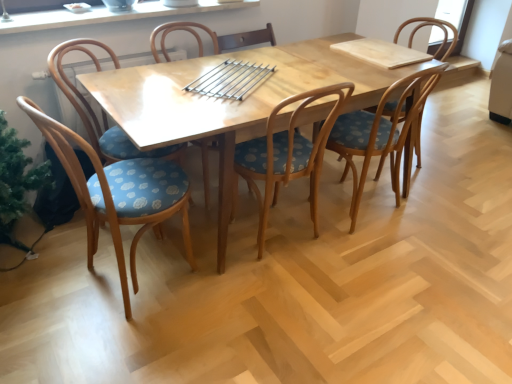
Question: From a real-world perspective, is blue polka dot wood chair at left, which is the 2th chair from left to right, positioned above or below natural wood table at center?

Choices:
 (A) below
 (B) above

Answer: (B)

Question: In terms of size, does blue polka dot wood chair at left, which appears as the fifth chair when viewed from the right, appear bigger or smaller than natural wood table at center?

Choices:
 (A) big
 (B) small

Answer: (B)

Question: Estimate the real-world distances between objects in this image. Which object is closer to the natural wood table at center?

Choices:
 (A) wooden chair with blue polka dot seat at center, acting as the 4th chair starting from the left
 (B) blue polka dot fabric chair at left, which is the first chair from left to right
 (C) white glossy window sill at upper center
 (D) wooden chair with blue polka dot seat cushion at center, which is counted as the 5th chair, starting from the left
 (E) blue polka dot wood chair at left, which is the 2th chair from left to right

Answer: (A)

Question: Considering the real-world distances, which object is closest to the blue polka dot wood chair at left, which is the 2th chair from left to right?

Choices:
 (A) blue polka dot fabric chair at center, acting as the 1th chair starting from the right
 (B) wooden chair with blue polka dot seat at center, the 4th chair from the right
 (C) white glossy window sill at upper center
 (D) wooden chair with blue polka dot seat at center, which ranks as the 3th chair in right-to-left order
 (E) natural wood table at center

Answer: (E)